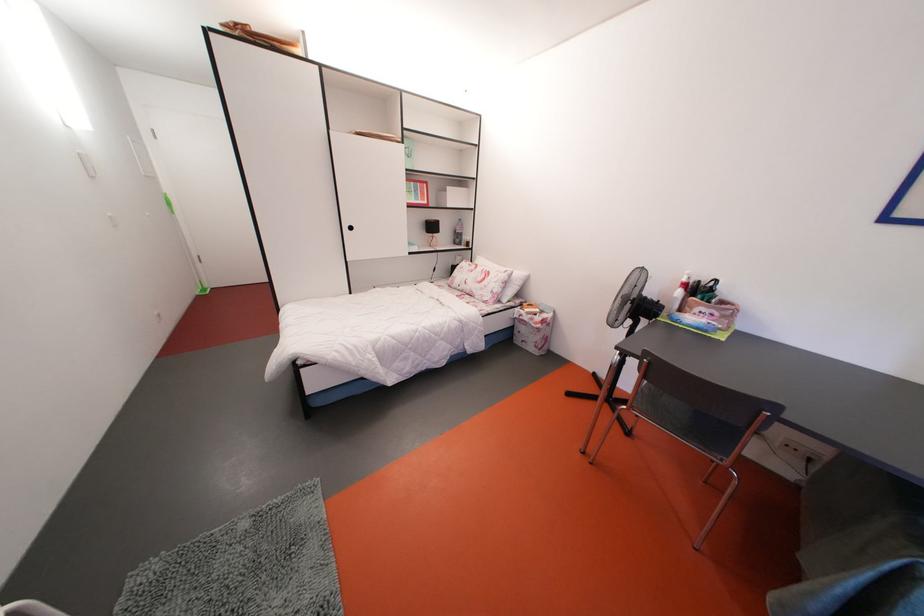
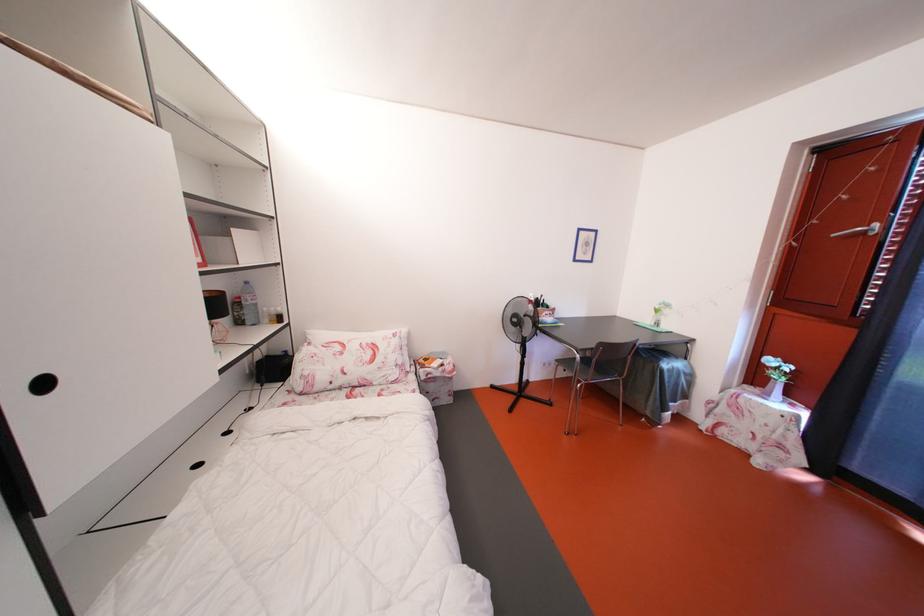
Locate, in the second image, the point that corresponds to the point at 358,233 in the first image.

(52, 390)